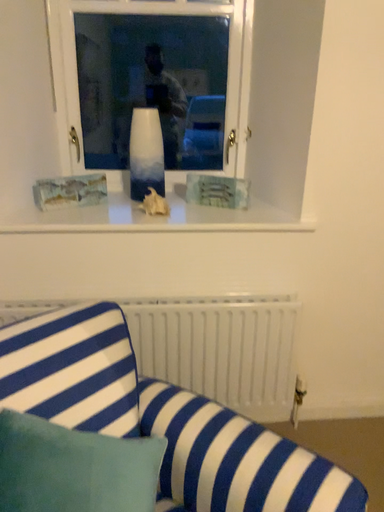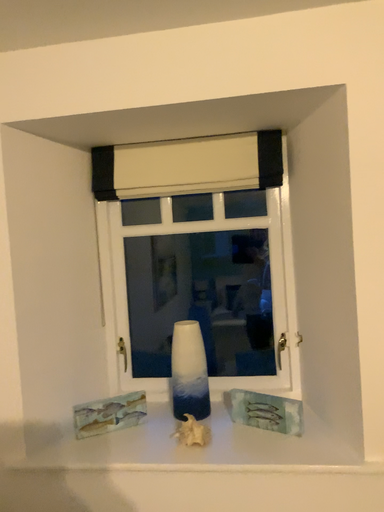
Question: Which way did the camera rotate in the video?

Choices:
 (A) rotated right
 (B) rotated left

Answer: (B)